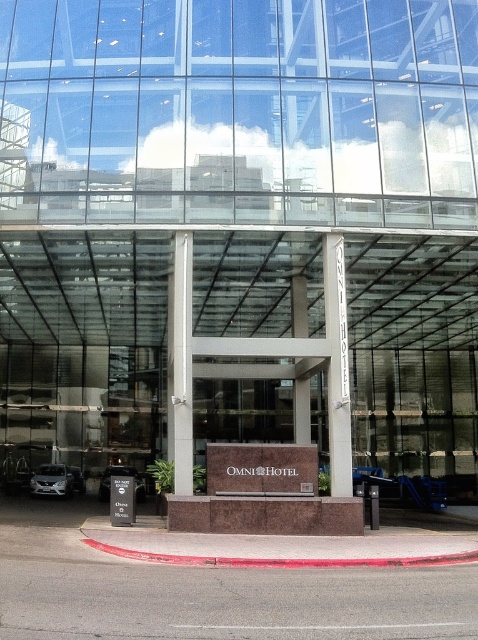
You are standing at the entrance of the Omni Hotel and want to locate the satin silver column at center and the white stone sign at center. According to the scene, which object is positioned to the left of the other?

The satin silver column at center is to the left of the white stone sign at center.

You are standing at the entrance of the Omni Hotel and want to take a photo of both the white stone sign at center and the shiny silver car at lower left. Which object should you focus on first to ensure both are in clear view?

The white stone sign at center is closer to the viewer than the shiny silver car at lower left, so focus on the white stone sign at center first to ensure both are in clear view.